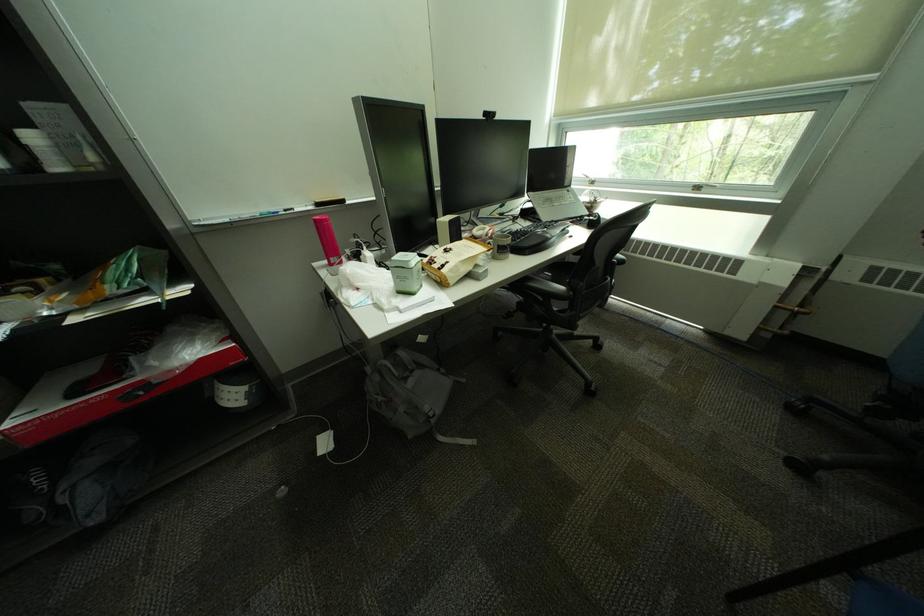
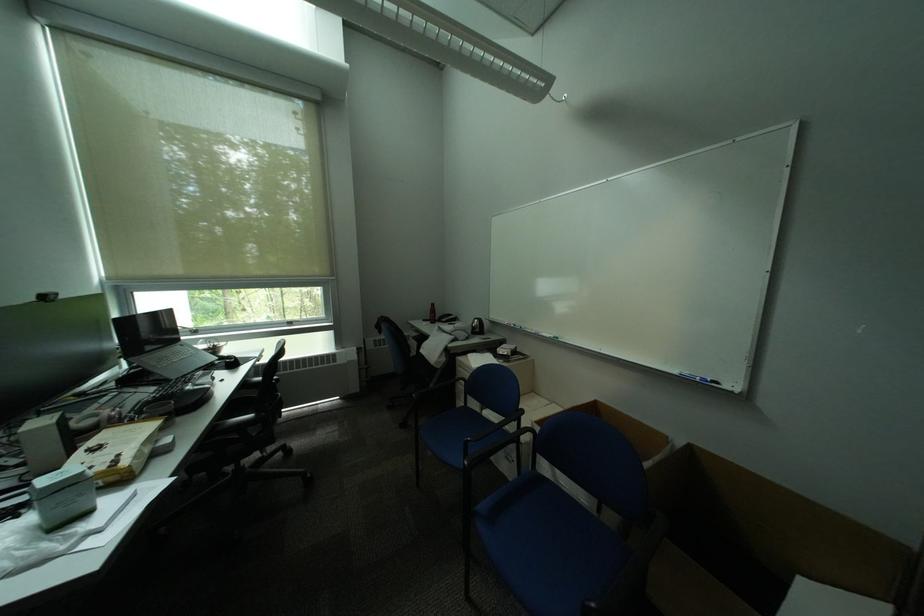
Question: The camera is either moving clockwise (left) or counter-clockwise (right) around the object. The first image is from the beginning of the video and the second image is from the end. Is the camera moving left or right when shooting the video?

Choices:
 (A) Left
 (B) Right

Answer: (A)